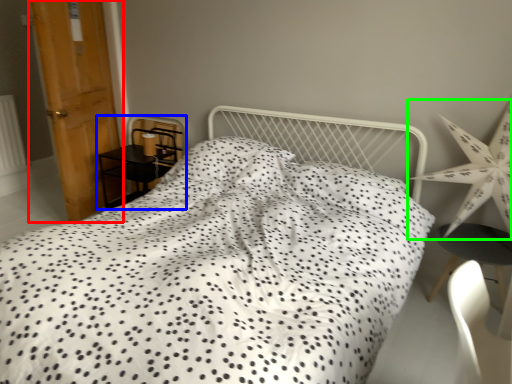
Question: Which object is positioned closest to door (highlighted by a red box)? Select from furniture (highlighted by a blue box) and star (highlighted by a green box).

Choices:
 (A) furniture
 (B) star

Answer: (A)